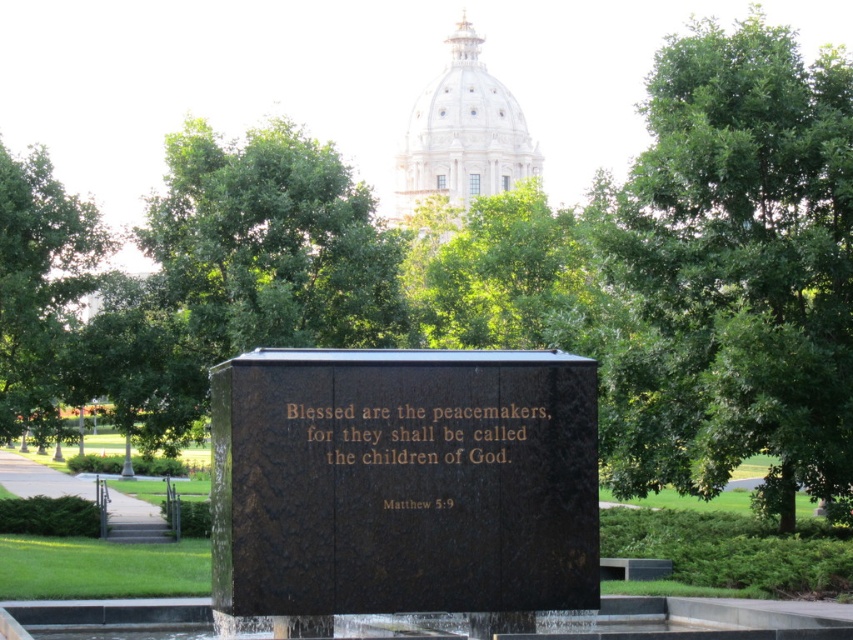
Question: Does bronze textured plaque at center come in front of goldmaterial/textureinscription at center?

Choices:
 (A) no
 (B) yes

Answer: (B)

Question: Considering the real-world distances, which object is farthest from the green leafy tree at left?

Choices:
 (A) goldmaterial/textureinscription at center
 (B) bronze textured plaque at center
 (C) green leafy tree at center

Answer: (A)

Question: Which object appears closest to the camera in this image?

Choices:
 (A) green leafy tree at left
 (B) green leafy tree at center
 (C) bronze textured plaque at center
 (D) goldmaterial/textureinscription at center

Answer: (C)

Question: Where is green leafy tree at center located in relation to goldmaterial/textureinscription at center in the image?

Choices:
 (A) right
 (B) left

Answer: (A)

Question: Is green leafy tree at center closer to camera compared to goldmaterial/textureinscription at center?

Choices:
 (A) yes
 (B) no

Answer: (B)

Question: Which object is the farthest from the goldmaterial/textureinscription at center?

Choices:
 (A) bronze textured plaque at center
 (B) green leafy tree at center
 (C) green leafy tree at left

Answer: (C)